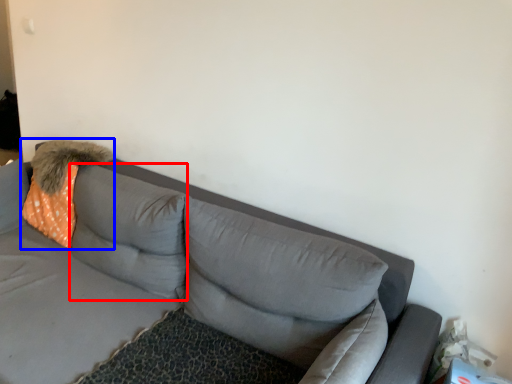
Question: Which object appears closest to the camera in this image, pillow (highlighted by a red box) or throw pillow (highlighted by a blue box)?

Choices:
 (A) pillow
 (B) throw pillow

Answer: (A)